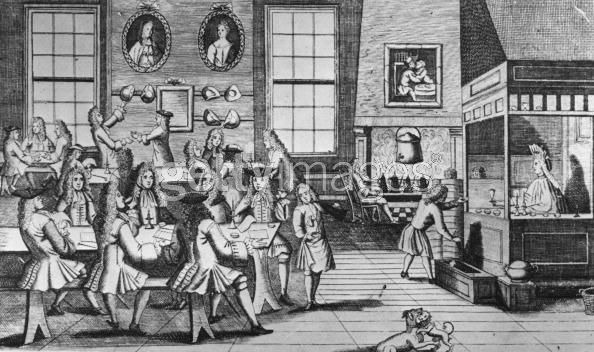
Locate an element on the screen. hanging pot is located at coordinates (415, 154).